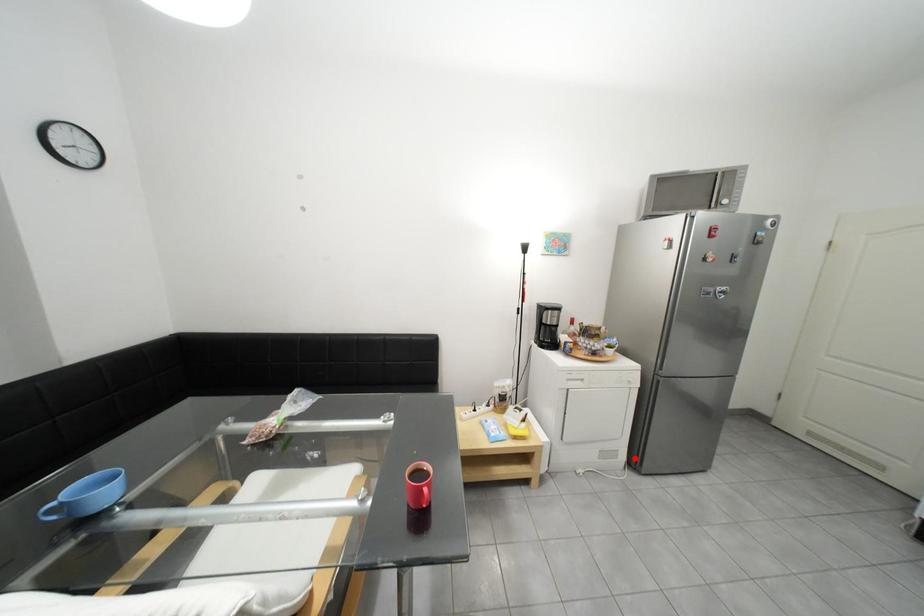
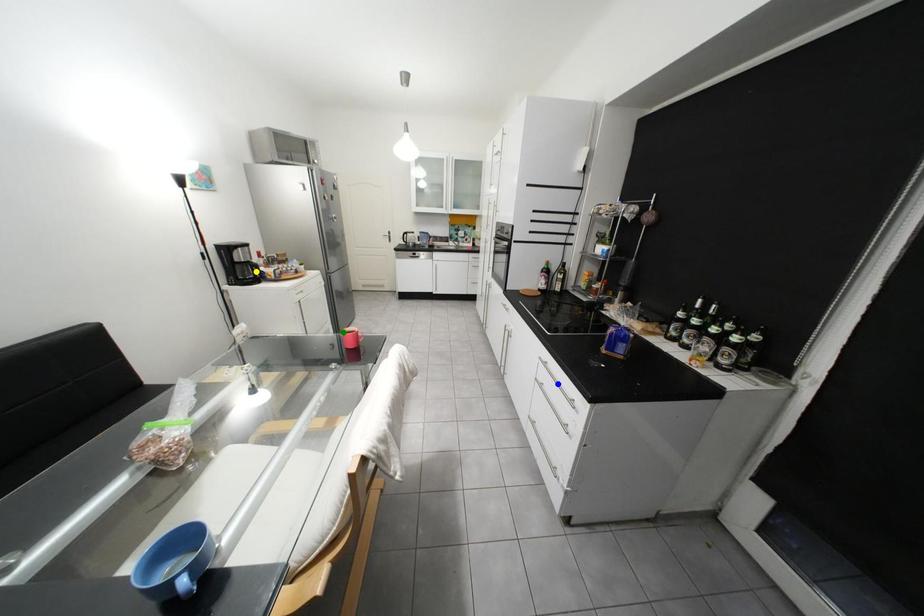
Question: I am providing you with two images of the same scene from different viewpoints. A red point is marked on the first image. You are given multiple points on the second image. Which spot in image 2 lines up with the point in image 1?

Choices:
 (A) green point
 (B) blue point
 (C) yellow point

Answer: (A)